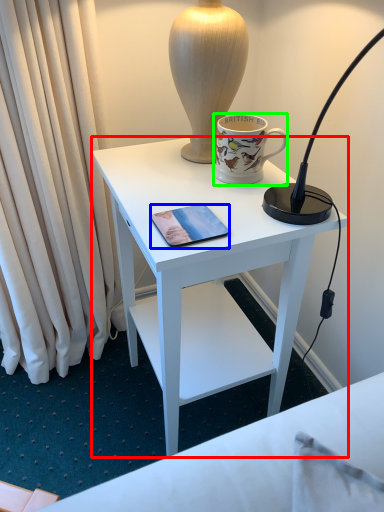
Question: Considering the real-world distances, which object is farthest from desk (highlighted by a red box)? mobile phone (highlighted by a blue box) or coffee cup (highlighted by a green box)?

Choices:
 (A) mobile phone
 (B) coffee cup

Answer: (A)